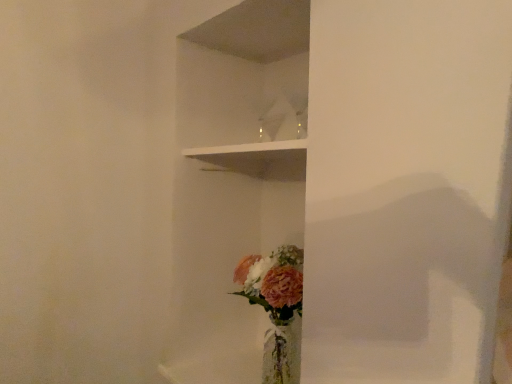
The height and width of the screenshot is (384, 512). I want to click on pastel floral bouquet at center, so click(x=276, y=308).

Describe the element at coordinates (276, 308) in the screenshot. I see `pastel floral bouquet at center` at that location.

The height and width of the screenshot is (384, 512). In order to click on pastel floral bouquet at center in this screenshot , I will do `click(276, 308)`.